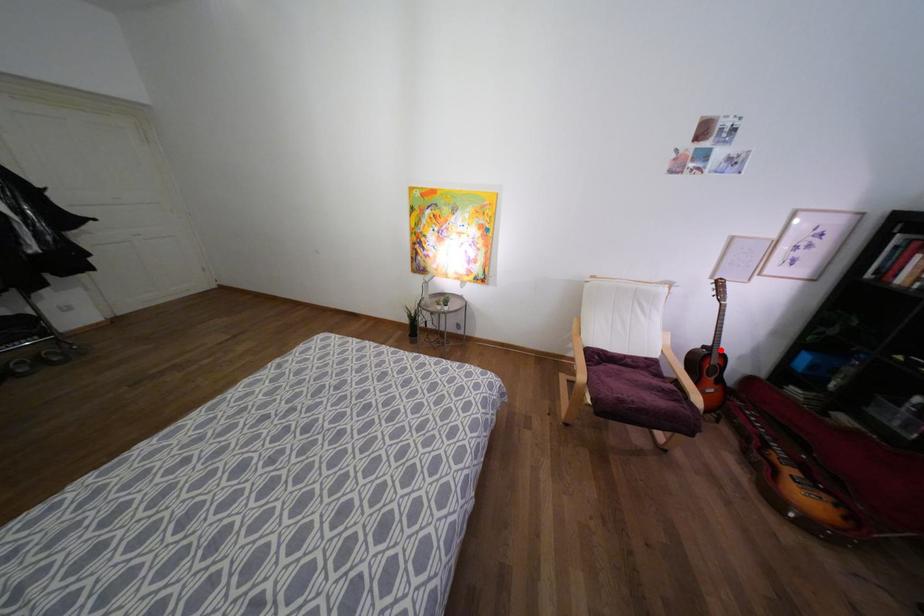
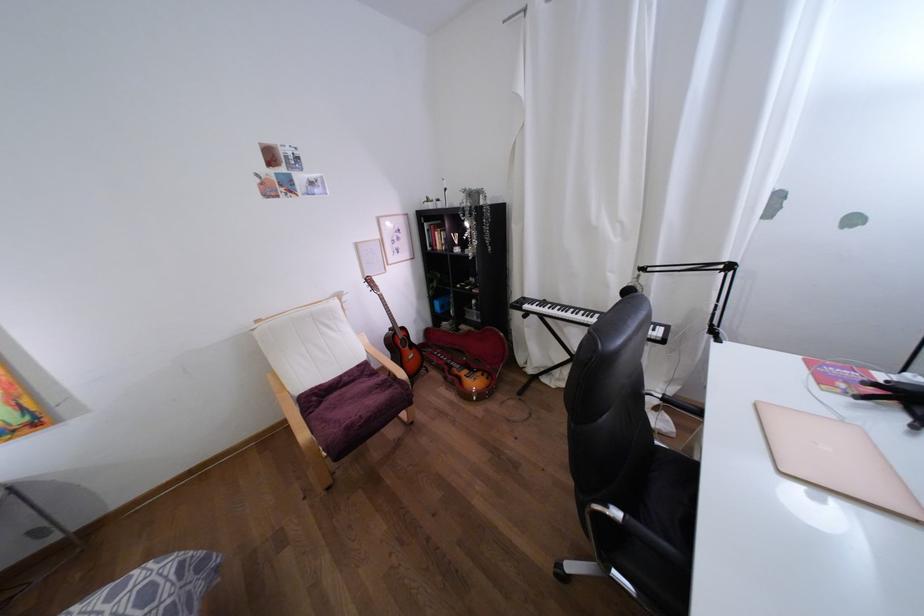
Question: I am providing you with two images of the same scene from different viewpoints. A red point is marked on the first image. At the location where the point appears in image 1, is it still visible in image 2?

Choices:
 (A) Yes
 (B) No

Answer: (A)